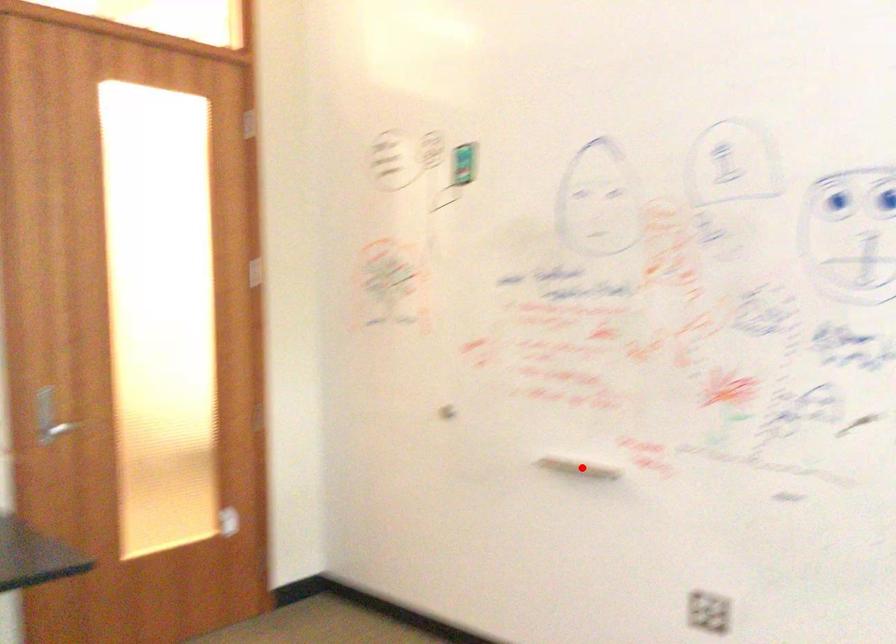
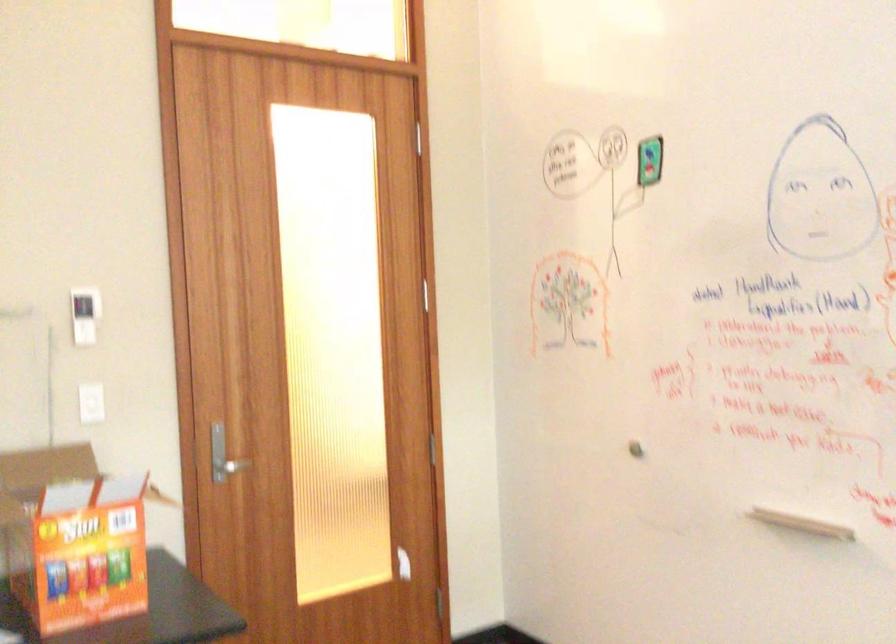
Find the pixel in the second image that matches the highlighted location in the first image.

(800, 522)